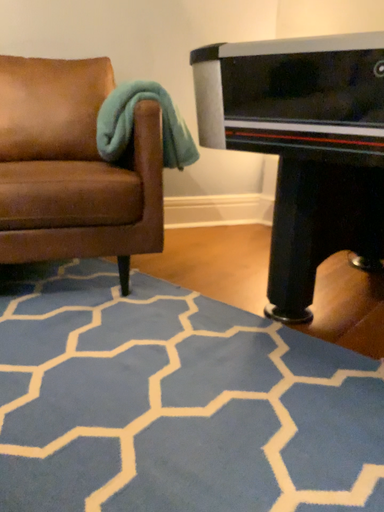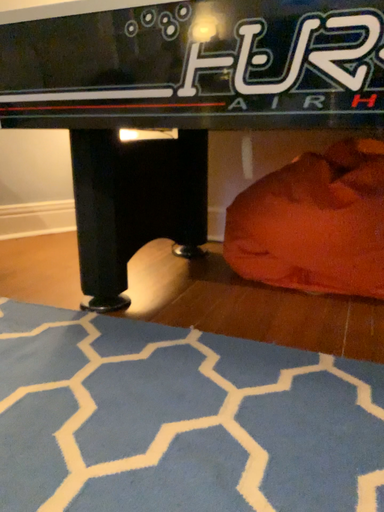
Question: How did the camera likely rotate when shooting the video?

Choices:
 (A) rotated left
 (B) rotated right

Answer: (B)